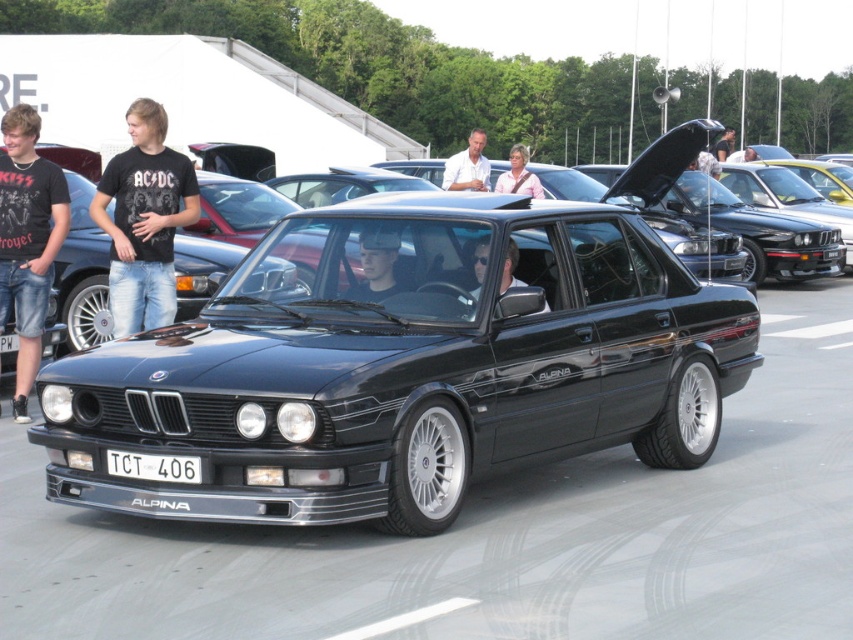
Between black metallic sedan at center and pink fabric shirt at center, which one appears on the right side from the viewer's perspective?

From the viewer's perspective, pink fabric shirt at center appears more on the right side.

Is black metallic sedan at center thinner than pink fabric shirt at center?

No, black metallic sedan at center is not thinner than pink fabric shirt at center.

Measure the distance between point (457, 390) and camera.

They are 6.14 meters apart.

Where is `black metallic sedan at center`? The width and height of the screenshot is (853, 640). black metallic sedan at center is located at coordinates (405, 365).

Does point (30, 202) come farther from viewer compared to point (720, 148)?

No, (30, 202) is closer to viewer.

Does black cotton t-shirt at left appear over light brown leather jacket at center?

No.

Which is behind, point (55, 237) or point (730, 147)?

The point (730, 147) is behind.

The image size is (853, 640). I want to click on black cotton t-shirt at left, so click(27, 241).

Which is behind, point (38, 342) or point (364, 228)?

Point (38, 342)

Looking at this image, does black cotton t-shirt at left come behind matte black helmet at center?

Yes, black cotton t-shirt at left is behind matte black helmet at center.

Measure the distance between point (39, 253) and camera.

A distance of 8.41 meters exists between point (39, 253) and camera.

Locate an element on the screen. The image size is (853, 640). black cotton t-shirt at left is located at coordinates (27, 241).